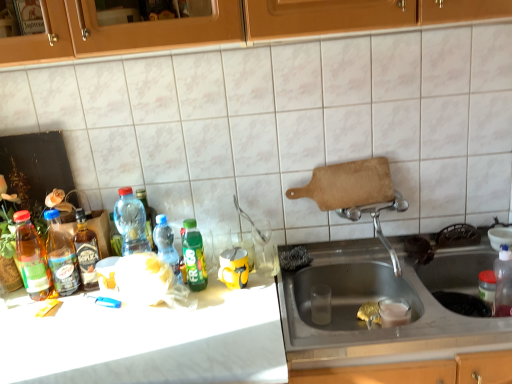
The height and width of the screenshot is (384, 512). What are the coordinates of `free point to the right of green matte bottle at center, which is counted as the second bottle, starting from the right` in the screenshot? It's located at (248, 298).